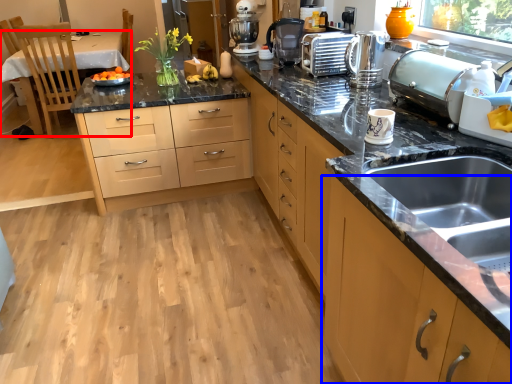
Question: Among these objects, which one is farthest to the camera, table (highlighted by a red box) or cabinetry (highlighted by a blue box)?

Choices:
 (A) table
 (B) cabinetry

Answer: (A)